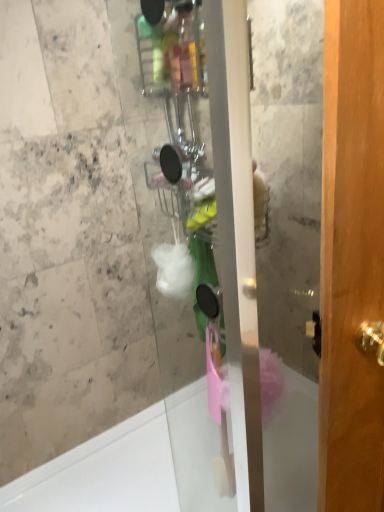
Locate an element on the screen. The height and width of the screenshot is (512, 384). white glossy bath at lower left is located at coordinates (133, 465).

The height and width of the screenshot is (512, 384). Describe the element at coordinates (133, 465) in the screenshot. I see `white glossy bath at lower left` at that location.

Identify the location of white glossy bath at lower left. 133,465.